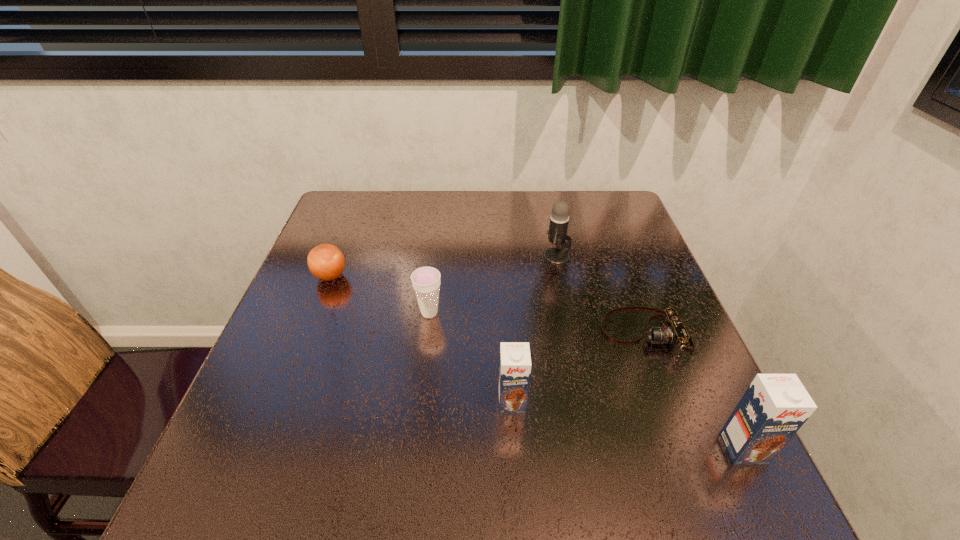
The width and height of the screenshot is (960, 540). I want to click on vacant area in the image that satisfies the following two spatial constraints: 1. on the front-facing side of the shortest object; 2. on the front label of the shorter chocolate milk, so [x=670, y=402].

Where is `free point that satisfies the following two spatial constraints: 1. on the front-facing side of the shortest object; 2. on the front label of the farther chocolate milk`? free point that satisfies the following two spatial constraints: 1. on the front-facing side of the shortest object; 2. on the front label of the farther chocolate milk is located at coordinates (670, 402).

You are a GUI agent. You are given a task and a screenshot of the screen. Output one action in this format:
    pyautogui.click(x=<x>, y=<y>)
    Task: Click on the vacant position in the image that satisfies the following two spatial constraints: 1. on the front-facing side of the shortest object; 2. on the front label of the left chocolate milk
    
    Given the screenshot: What is the action you would take?
    pyautogui.click(x=670, y=402)

You are a GUI agent. You are given a task and a screenshot of the screen. Output one action in this format:
    pyautogui.click(x=<x>, y=<y>)
    Task: Click on the vacant position in the image that satisfies the following two spatial constraints: 1. on the front-facing side of the camera; 2. on the front label of the fifth farthest object
    The image size is (960, 540).
    Given the screenshot: What is the action you would take?
    pyautogui.click(x=670, y=402)